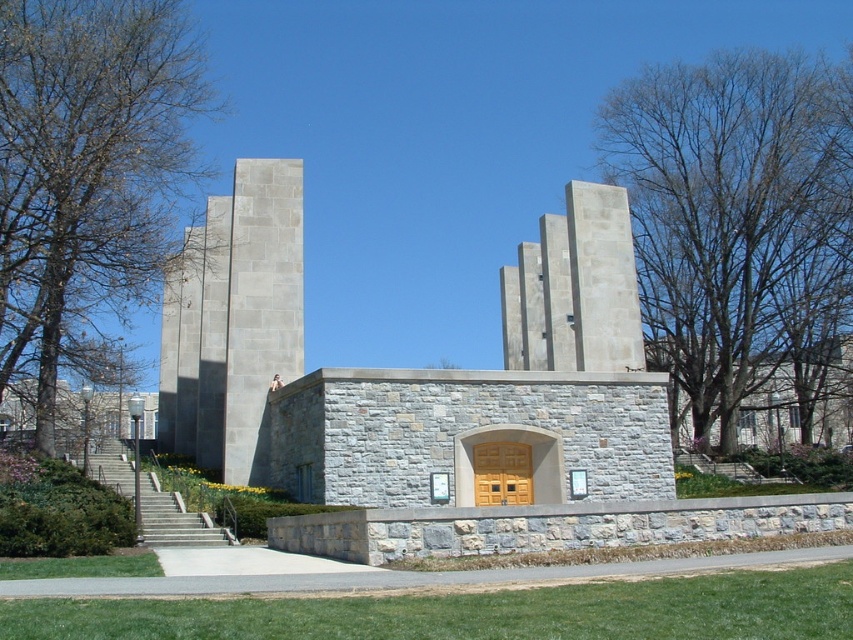
From the picture: Which is more to the right, gray stone tower at center or light beige stone tower at center?

Positioned to the right is light beige stone tower at center.

Can you confirm if gray stone tower at center is positioned below light beige stone tower at center?

Indeed, gray stone tower at center is positioned under light beige stone tower at center.

Is point (265, 257) farther from camera compared to point (583, 333)?

No, (265, 257) is in front of (583, 333).

Image resolution: width=853 pixels, height=640 pixels. In order to click on gray stone tower at center in this screenshot , I will do `click(233, 321)`.

Does bare branches at right appear under gray stone tower at center?

No, bare branches at right is not below gray stone tower at center.

Can you confirm if bare branches at right is positioned to the left of gray stone tower at center?

In fact, bare branches at right is to the right of gray stone tower at center.

Which is in front, point (665, 240) or point (248, 288)?

Point (248, 288) is more forward.

The image size is (853, 640). Find the location of `bare branches at right`. bare branches at right is located at coordinates (737, 221).

Is brown leafy tree at upper left bigger than light beige stone tower at center?

Yes.

Which is behind, point (51, 397) or point (512, 298)?

Positioned behind is point (512, 298).

In order to click on brown leafy tree at upper left in this screenshot , I will do `click(86, 166)`.